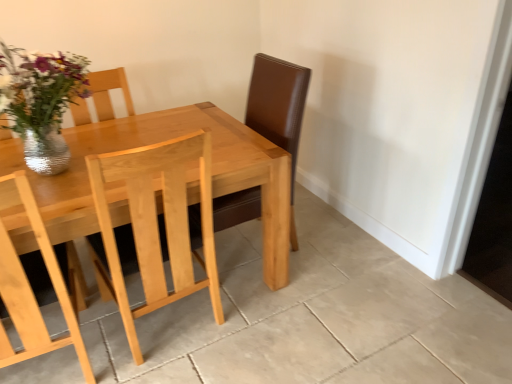
Question: From a real-world perspective, is light wood table at center on light wood chair at center?

Choices:
 (A) no
 (B) yes

Answer: (A)

Question: Does light wood table at center have a smaller size compared to light wood chair at center?

Choices:
 (A) yes
 (B) no

Answer: (B)

Question: Is light wood table at center oriented away from light wood chair at center?

Choices:
 (A) yes
 (B) no

Answer: (A)

Question: From the image's perspective, is light wood table at center located above light wood chair at center?

Choices:
 (A) no
 (B) yes

Answer: (B)

Question: Is light wood table at center positioned before light wood chair at center?

Choices:
 (A) yes
 (B) no

Answer: (A)

Question: Is light wood table at center positioned beyond the bounds of light wood chair at center?

Choices:
 (A) no
 (B) yes

Answer: (B)

Question: From the image's perspective, is light wood chair at center located above metallic silver vase at upper left?

Choices:
 (A) no
 (B) yes

Answer: (A)

Question: Can metallic silver vase at upper left be found inside light wood chair at center?

Choices:
 (A) yes
 (B) no

Answer: (B)

Question: From a real-world perspective, is light wood chair at center physically above metallic silver vase at upper left?

Choices:
 (A) yes
 (B) no

Answer: (B)

Question: Is light wood chair at center further to camera compared to metallic silver vase at upper left?

Choices:
 (A) no
 (B) yes

Answer: (A)

Question: Does light wood chair at center come in front of metallic silver vase at upper left?

Choices:
 (A) no
 (B) yes

Answer: (B)

Question: Is light wood chair at center wider than metallic silver vase at upper left?

Choices:
 (A) no
 (B) yes

Answer: (B)

Question: Is metallic silver vase at upper left to the right of light wood table at center from the viewer's perspective?

Choices:
 (A) yes
 (B) no

Answer: (B)